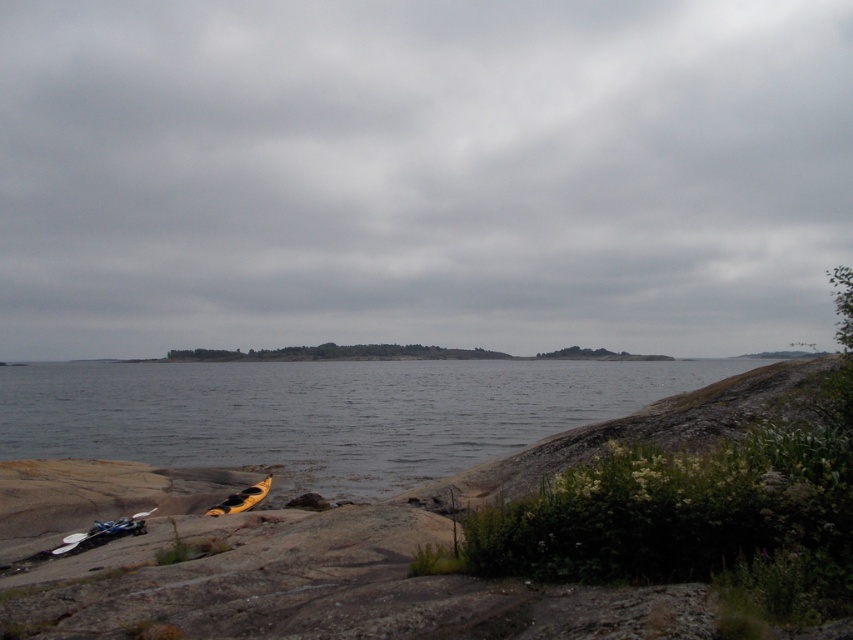
Question: Is clear water at lower left to the left of blue plastic kayak at lower left from the viewer's perspective?

Choices:
 (A) yes
 (B) no

Answer: (A)

Question: Which object is positioned farthest from the clear water at lower left?

Choices:
 (A) yellow matte kayak at lower left
 (B) blue plastic kayak at lower left

Answer: (B)

Question: Does clear water at lower left appear on the right side of blue plastic kayak at lower left?

Choices:
 (A) no
 (B) yes

Answer: (A)

Question: Which point appears farthest from the camera in this image?

Choices:
 (A) (103, 541)
 (B) (305, 451)
 (C) (257, 496)

Answer: (B)

Question: Is clear water at lower left wider than blue plastic kayak at lower left?

Choices:
 (A) no
 (B) yes

Answer: (B)

Question: Among these objects, which one is farthest from the camera?

Choices:
 (A) clear water at lower left
 (B) yellow matte kayak at lower left

Answer: (A)